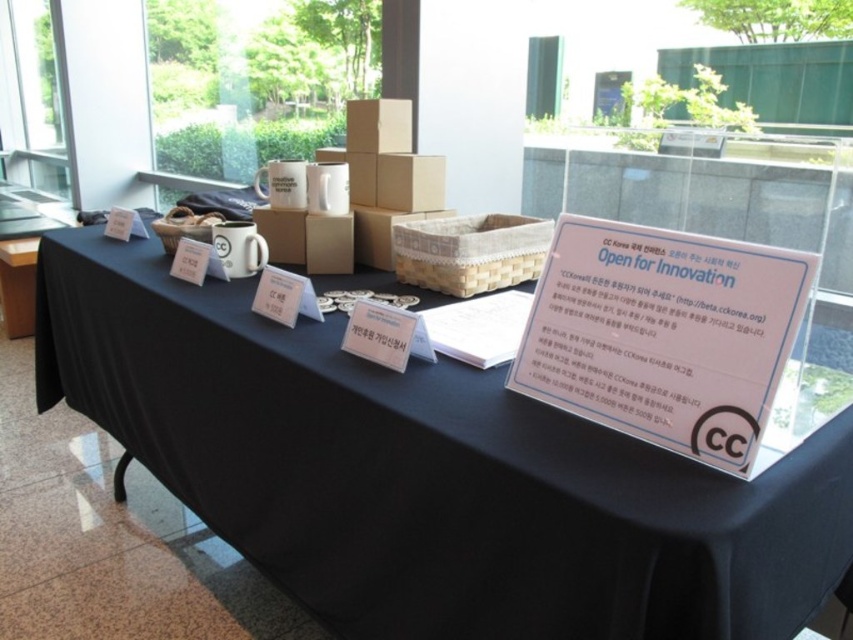
Who is positioned more to the right, black matte tablecloth at center or white plastic sign at center?

white plastic sign at center

In the scene shown: Is black matte tablecloth at center smaller than white plastic sign at center?

Incorrect, black matte tablecloth at center is not smaller in size than white plastic sign at center.

Is point (311, 474) farther from camera compared to point (601, 259)?

Yes.

The height and width of the screenshot is (640, 853). I want to click on black matte tablecloth at center, so click(426, 474).